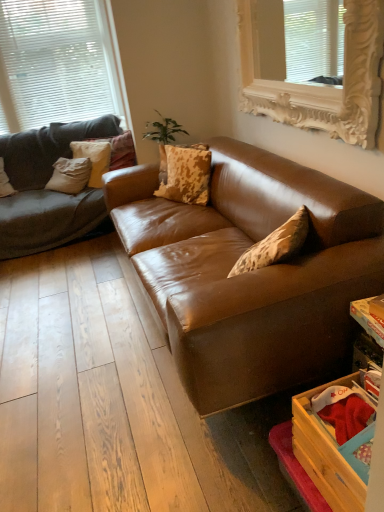
Question: In terms of width, does white ornate frame at upper center, which ranks as the 2th window in left-to-right order, look wider or thinner when compared to white textured pillow at upper left, the 3th pillow when ordered from left to right?

Choices:
 (A) thin
 (B) wide

Answer: (A)

Question: Considering their positions, is white ornate frame at upper center, which ranks as the 2th window in left-to-right order, located in front of or behind white textured pillow at upper left, positioned as the second pillow in right-to-left order?

Choices:
 (A) front
 (B) behind

Answer: (A)

Question: Estimate the real-world distances between objects in this image. Which object is farther from the white ornate frame at upper center, which ranks as the 2th window in left-to-right order?

Choices:
 (A) white matte window at upper left, which is the 2th window from front to back
 (B) brown leather couch at center
 (C) textured beige pillow at left, marked as the second pillow in a left-to-right arrangement
 (D) white textured pillow at upper left, positioned as the second pillow in right-to-left order
 (E) matte gray pillow at left, the fourth pillow when ordered from right to left

Answer: (E)

Question: Estimate the real-world distances between objects in this image. Which object is closer to the matte gray pillow at left, the fourth pillow when ordered from right to left?

Choices:
 (A) white textured pillow at upper left, positioned as the second pillow in right-to-left order
 (B) white ornate frame at upper center, which ranks as the first window in right-to-left order
 (C) brown leather couch at center
 (D) wooden crate at lower right
 (E) white matte window at upper left, the second window when ordered from right to left

Answer: (A)